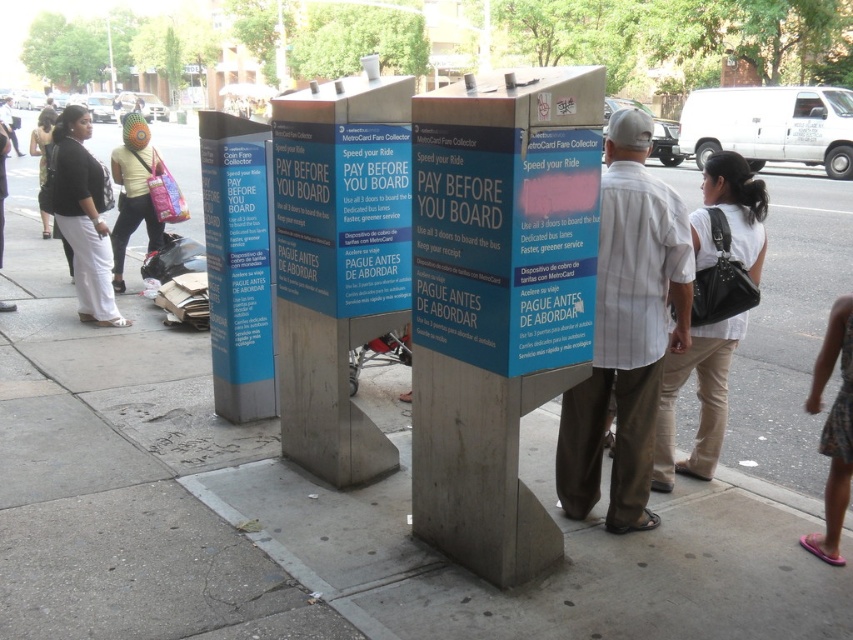
Question: Does blue plastic sign at center have a smaller size compared to black cotton pants at left?

Choices:
 (A) no
 (B) yes

Answer: (B)

Question: Among these points, which one is farthest from the camera?

Choices:
 (A) (840, 515)
 (B) (521, 234)

Answer: (A)

Question: Is white cotton shirt at center positioned before pink flip-flops at lower right?

Choices:
 (A) yes
 (B) no

Answer: (A)

Question: Which point is closer to the camera taking this photo?

Choices:
 (A) (514, 179)
 (B) (137, 150)

Answer: (A)

Question: Does white cotton shirt at center have a smaller size compared to pink flip-flops at lower right?

Choices:
 (A) no
 (B) yes

Answer: (A)

Question: Among these points, which one is farthest from the camera?

Choices:
 (A) (810, 410)
 (B) (74, 180)

Answer: (B)